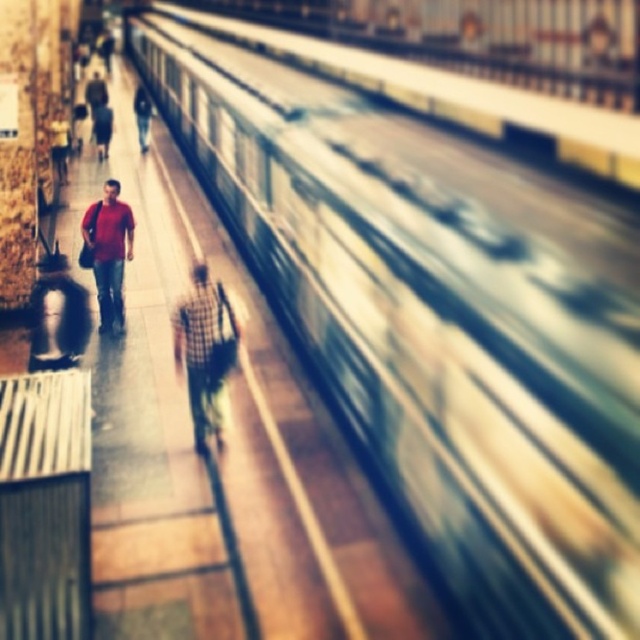
Question: Is green plaid shirt at center behind dark blue jeans at center?

Choices:
 (A) yes
 (B) no

Answer: (B)

Question: Does matte red shirt at center come behind matte black jacket at upper left?

Choices:
 (A) yes
 (B) no

Answer: (B)

Question: Among these objects, which one is nearest to the camera?

Choices:
 (A) dark blue jeans at center
 (B) matte red shirt at center
 (C) green plaid shirt at center
 (D) matte black jacket at upper left

Answer: (C)

Question: Which point is closer to the camera taking this photo?

Choices:
 (A) [147, 102]
 (B) [96, 120]

Answer: (B)

Question: Can you confirm if matte black jacket at upper left is thinner than dark blue jeans at center?

Choices:
 (A) no
 (B) yes

Answer: (B)

Question: Which point is farther from the camera taking this photo?

Choices:
 (A) (99, 115)
 (B) (109, 307)

Answer: (A)